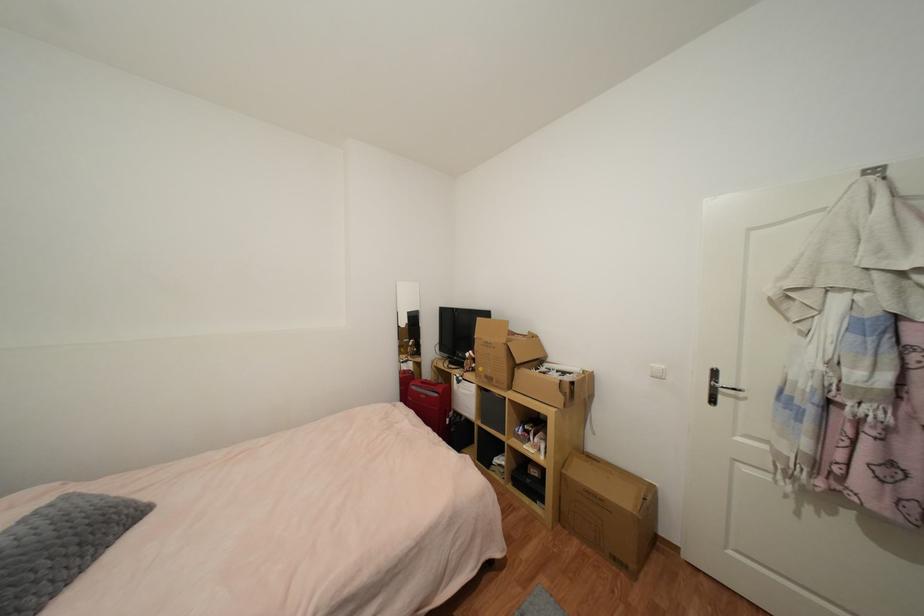
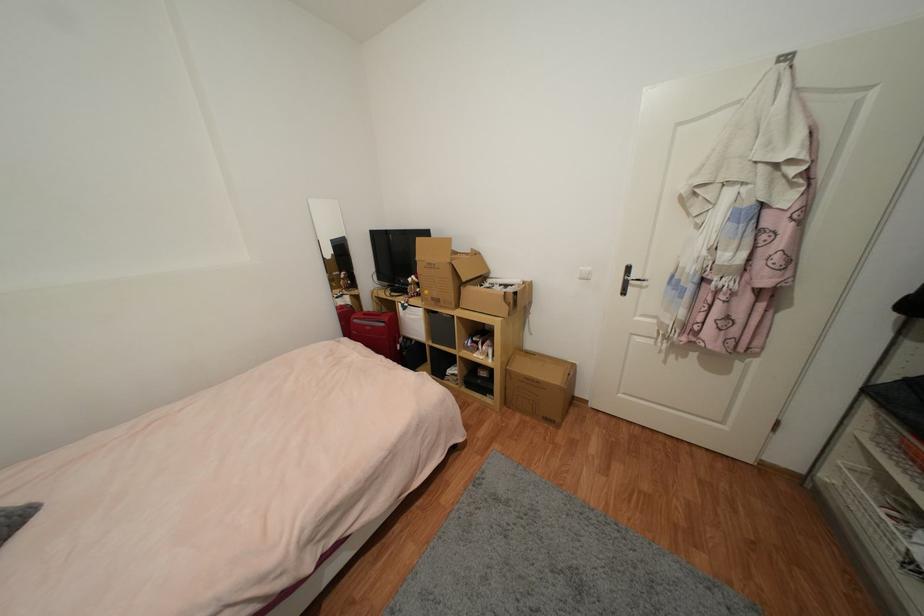
Question: Based on the continuous images, in which direction is the camera rotating? Reply with the corresponding letter.

Choices:
 (A) Left
 (B) Right
 (C) Up
 (D) Down

Answer: (D)